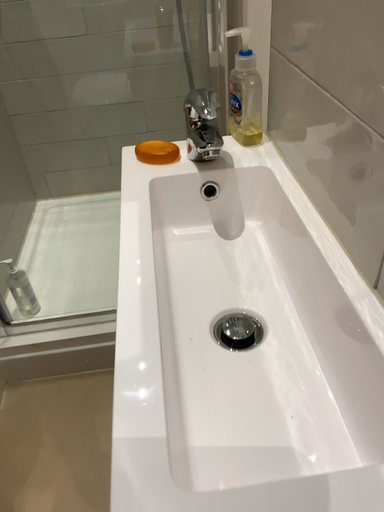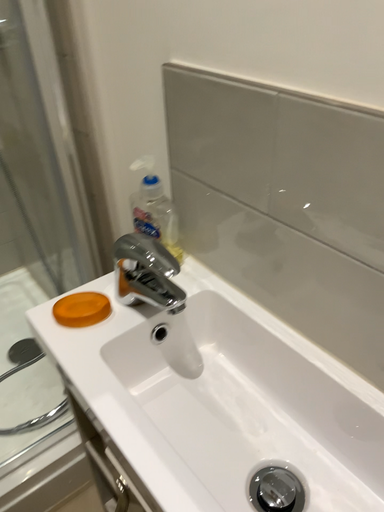
Question: Which way did the camera rotate in the video?

Choices:
 (A) rotated upward
 (B) rotated downward

Answer: (A)